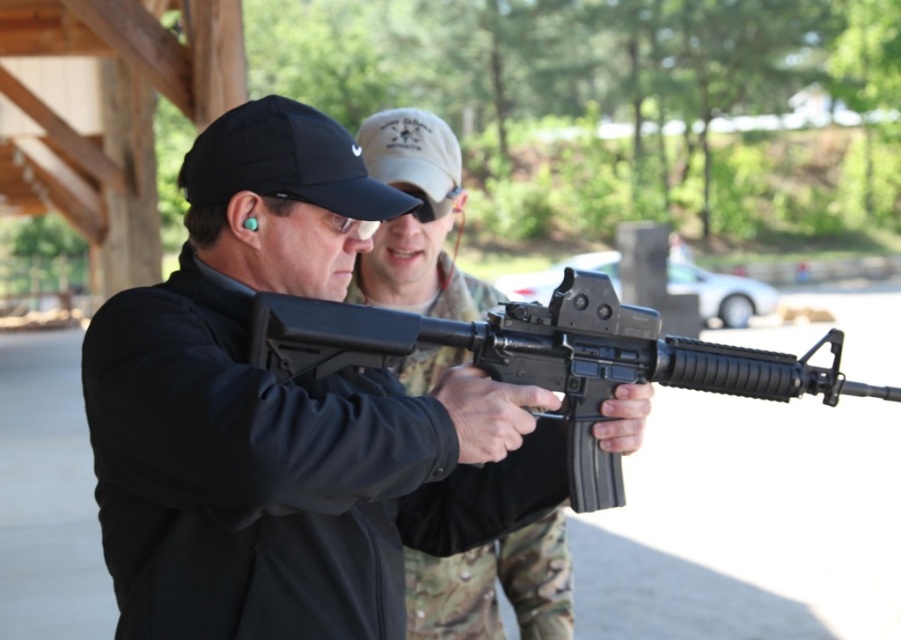
Question: Which object is positioned closest to the black matte rifle at center?

Choices:
 (A) matte black rifle at center
 (B) black fabric baseball cap at upper center

Answer: (B)

Question: Can you confirm if black matte rifle at center is smaller than black fabric baseball cap at upper center?

Choices:
 (A) no
 (B) yes

Answer: (A)

Question: In this image, where is matte black rifle at center located relative to black fabric baseball cap at upper center?

Choices:
 (A) right
 (B) left

Answer: (A)

Question: Which of these objects is positioned closest to the black fabric baseball cap at upper center?

Choices:
 (A) matte black rifle at center
 (B) black matte rifle at center

Answer: (B)

Question: Which object is positioned farthest from the matte black rifle at center?

Choices:
 (A) black matte rifle at center
 (B) black fabric baseball cap at upper center

Answer: (A)

Question: From the image, what is the correct spatial relationship of matte black rifle at center in relation to black fabric baseball cap at upper center?

Choices:
 (A) right
 (B) left

Answer: (A)